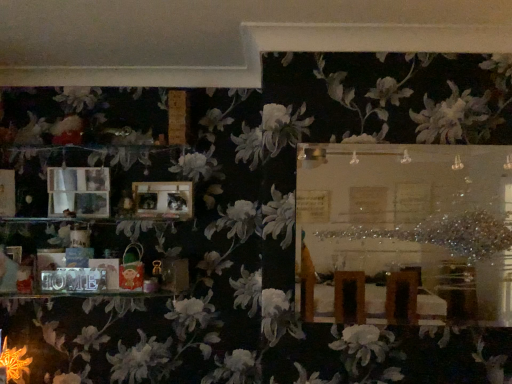
Where is `free spot above wooden frame at upper center (from a real-world perspective)`? This screenshot has width=512, height=384. free spot above wooden frame at upper center (from a real-world perspective) is located at coordinates (391, 139).